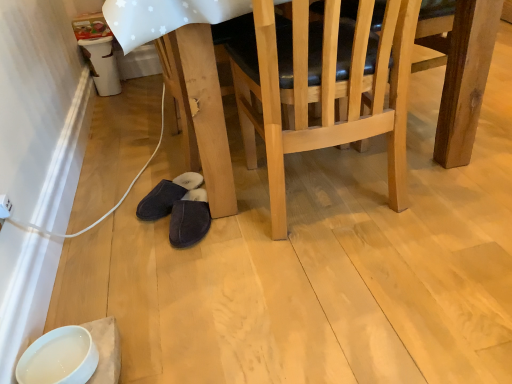
Question: Is dark suede slippers at lower center, the first footwear when ordered from right to left, wider or thinner than natural wood chair at center?

Choices:
 (A) wide
 (B) thin

Answer: (B)

Question: Considering the relative positions of dark suede slippers at lower center, the first footwear when ordered from right to left, and natural wood chair at center in the image provided, is dark suede slippers at lower center, the first footwear when ordered from right to left, to the left or to the right of natural wood chair at center?

Choices:
 (A) left
 (B) right

Answer: (A)

Question: Which is nearer to the wooden table at lower center?

Choices:
 (A) natural wood chair at center
 (B) dark suede slippers at lower center, arranged as the second footwear when viewed from the left
 (C) white glossy bowl at lower left
 (D) dark suede slippers at lower center, the first footwear when ordered from left to right

Answer: (B)

Question: Estimate the real-world distances between objects in this image. Which object is farther from the dark suede slippers at lower center, marked as the second footwear in a right-to-left arrangement?

Choices:
 (A) natural wood chair at center
 (B) dark suede slippers at lower center, arranged as the second footwear when viewed from the left
 (C) wooden table at lower center
 (D) white glossy bowl at lower left

Answer: (D)